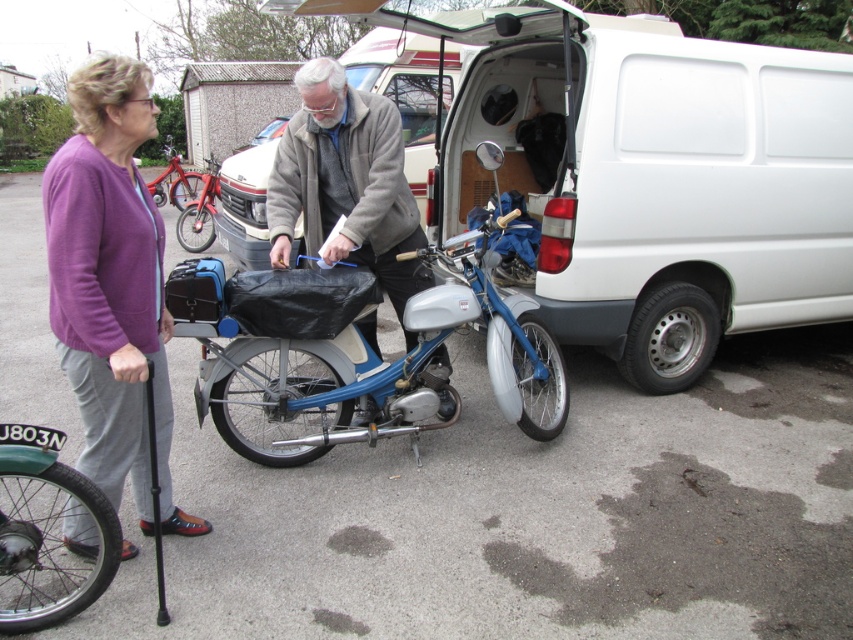
Question: Is gray woolen jacket at center thinner than green rubber tire at lower left?

Choices:
 (A) no
 (B) yes

Answer: (B)

Question: Which of these objects is positioned closest to the shiny red bicycle at center?

Choices:
 (A) matte black jacket at center
 (B) green rubber tire at lower left
 (C) white matte van at center
 (D) metallic red bicycle at left

Answer: (D)

Question: Among these points, which one is farthest from the camera?

Choices:
 (A) (149, 83)
 (B) (109, 467)
 (C) (170, 188)

Answer: (C)

Question: Which point is farther to the camera?

Choices:
 (A) (28, 588)
 (B) (335, 156)

Answer: (B)

Question: Can you confirm if green rubber tire at lower left is positioned to the right of shiny red bicycle at center?

Choices:
 (A) yes
 (B) no

Answer: (A)

Question: Where is shiny red bicycle at center located in relation to metallic red bicycle at left in the image?

Choices:
 (A) below
 (B) above

Answer: (A)